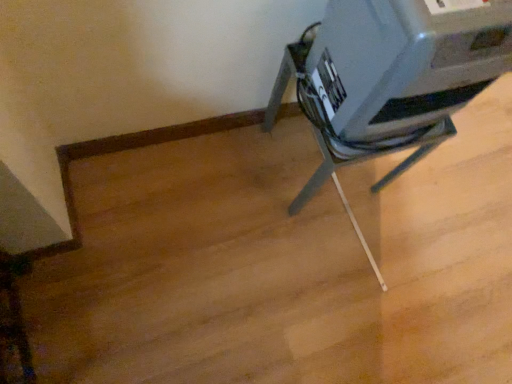
Identify the location of free location in front of metallic gray printer at center. (291, 243).